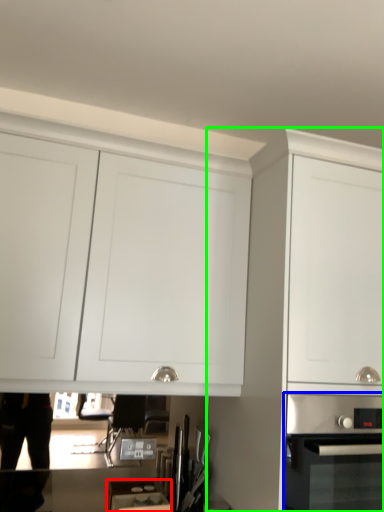
Question: Which is farther away from appliance (highlighted by a red box)? home appliance (highlighted by a blue box) or cabinetry (highlighted by a green box)?

Choices:
 (A) home appliance
 (B) cabinetry

Answer: (A)